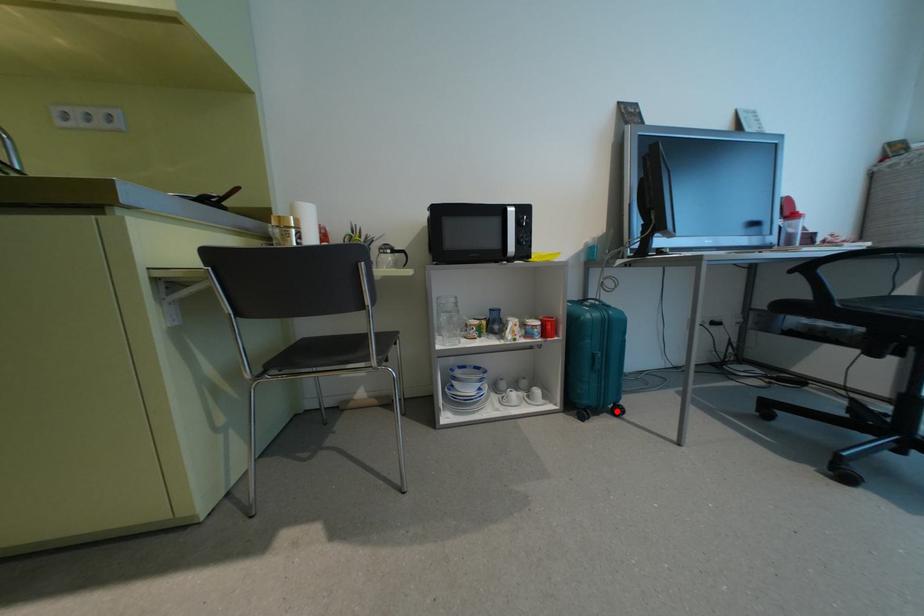
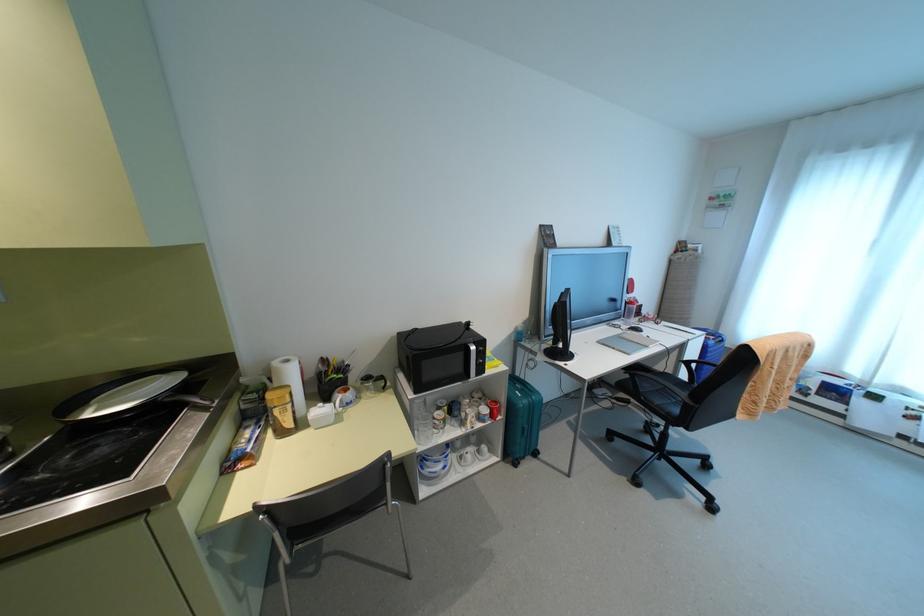
Question: I am providing you with two images of the same scene from different viewpoints. Given a red point in image1, look at the same physical point in image2. Is it:

Choices:
 (A) Closer to the viewpoint
 (B) Farther from the viewpoint

Answer: (B)